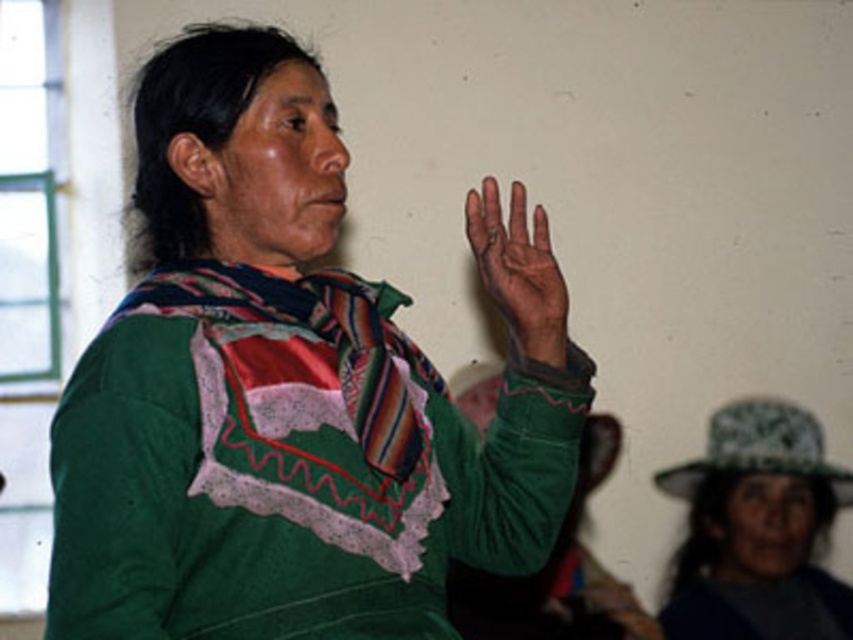
Who is shorter, green soft sweater at center or brown leather hand at upper center?

Standing shorter between the two is brown leather hand at upper center.

Does green soft sweater at center have a smaller size compared to brown leather hand at upper center?

No, green soft sweater at center is not smaller than brown leather hand at upper center.

This screenshot has width=853, height=640. What do you see at coordinates (291, 388) in the screenshot? I see `green soft sweater at center` at bounding box center [291, 388].

This screenshot has height=640, width=853. What are the coordinates of `green soft sweater at center` in the screenshot? It's located at (291, 388).

Is green soft sweater at center in front of camouflage fabric hat at lower right?

Yes, green soft sweater at center is in front of camouflage fabric hat at lower right.

Which of these two, green soft sweater at center or camouflage fabric hat at lower right, stands taller?

green soft sweater at center is taller.

Is point (309, 340) less distant than point (740, 572)?

Yes, it is.

Where is `green soft sweater at center`? This screenshot has height=640, width=853. green soft sweater at center is located at coordinates click(291, 388).

Who is more distant from viewer, (724, 561) or (520, 186)?

The point (724, 561) is more distant.

Is point (732, 621) positioned after point (474, 237)?

Yes, point (732, 621) is farther from viewer.

Who is more distant from viewer, (761, 472) or (491, 232)?

Positioned behind is point (761, 472).

Locate an element on the screen. The width and height of the screenshot is (853, 640). camouflage fabric hat at lower right is located at coordinates (757, 529).